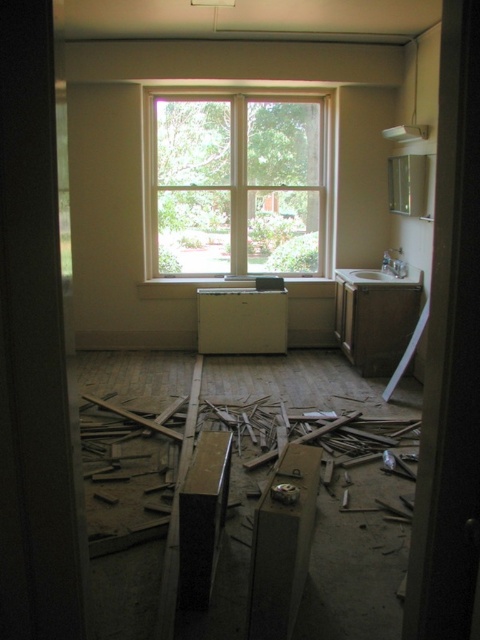
Which of these two, white matte sink at right or white glossy sink at center, stands taller?

white matte sink at right is taller.

Does white matte sink at right have a lesser width compared to white glossy sink at center?

Indeed, white matte sink at right has a lesser width compared to white glossy sink at center.

Is point (396, 305) positioned before point (402, 268)?

Yes.

Where is `white matte sink at right`? The width and height of the screenshot is (480, 640). white matte sink at right is located at coordinates (375, 316).

Which is in front, point (377, 310) or point (218, 330)?

Point (377, 310) is in front.

Who is shorter, white matte sink at right or white matte radiator at center?

Standing shorter between the two is white matte radiator at center.

Image resolution: width=480 pixels, height=640 pixels. Find the location of `white matte sink at right`. white matte sink at right is located at coordinates (375, 316).

Where is `white matte sink at right`? The image size is (480, 640). white matte sink at right is located at coordinates (375, 316).

Which is more to the left, white matte radiator at center or white glossy sink at center?

From the viewer's perspective, white matte radiator at center appears more on the left side.

In the scene shown: Can you confirm if white matte radiator at center is positioned to the left of white glossy sink at center?

Yes, white matte radiator at center is to the left of white glossy sink at center.

Between point (252, 301) and point (403, 273), which one is positioned in front?

Positioned in front is point (403, 273).

Where is `white matte radiator at center`? The width and height of the screenshot is (480, 640). white matte radiator at center is located at coordinates click(x=241, y=321).